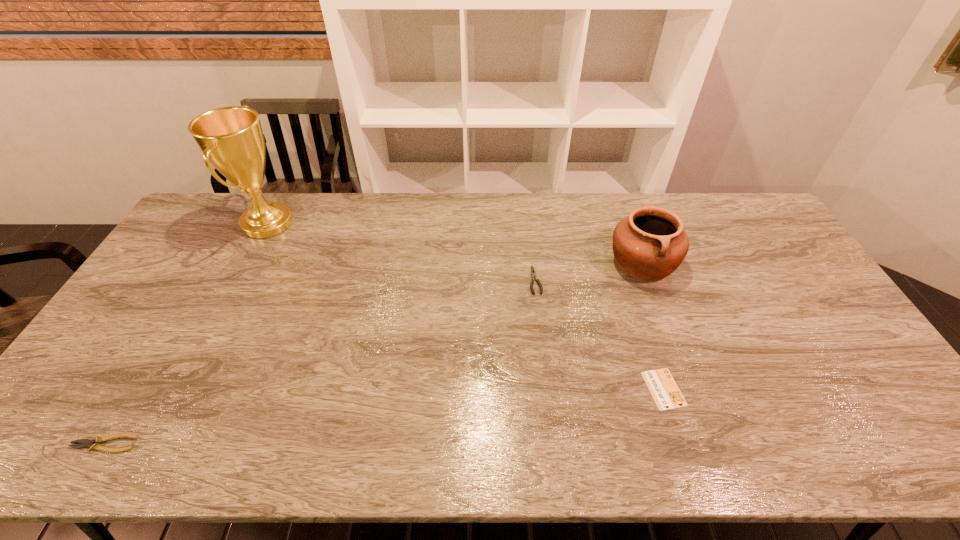
Image resolution: width=960 pixels, height=540 pixels. I want to click on free space between the left pliers and the pottery, so click(373, 353).

Locate an element on the screen. This screenshot has width=960, height=540. free space that is in between the tallest object and the pottery is located at coordinates (455, 244).

Select which object appears as the third closest to the nearest object. Please provide its 2D coordinates. Your answer should be formatted as a tuple, i.e. [(x, y)], where the tuple contains the x and y coordinates of a point satisfying the conditions above.

[(664, 390)]

Locate which object ranks fourth in proximity to the right pliers. Please provide its 2D coordinates. Your answer should be formatted as a tuple, i.e. [(x, y)], where the tuple contains the x and y coordinates of a point satisfying the conditions above.

[(94, 444)]

This screenshot has width=960, height=540. In order to click on free spot that satisfies the following two spatial constraints: 1. on the back side of the fourth shortest object; 2. on the left side of the left pliers in this screenshot , I will do `click(213, 263)`.

Image resolution: width=960 pixels, height=540 pixels. Find the location of `vacant space that satisfies the following two spatial constraints: 1. by the handles of the award; 2. on the back side of the second tallest object`. vacant space that satisfies the following two spatial constraints: 1. by the handles of the award; 2. on the back side of the second tallest object is located at coordinates (247, 263).

Image resolution: width=960 pixels, height=540 pixels. I want to click on vacant region that satisfies the following two spatial constraints: 1. by the handles of the award; 2. on the right side of the third object from right to left, so click(238, 280).

Where is `blank area in the image that satisfies the following two spatial constraints: 1. by the handles of the award; 2. on the back side of the farther pliers`? This screenshot has height=540, width=960. blank area in the image that satisfies the following two spatial constraints: 1. by the handles of the award; 2. on the back side of the farther pliers is located at coordinates (238, 280).

This screenshot has width=960, height=540. Find the location of `free point that satisfies the following two spatial constraints: 1. by the handles of the tallest object; 2. on the back side of the pottery`. free point that satisfies the following two spatial constraints: 1. by the handles of the tallest object; 2. on the back side of the pottery is located at coordinates (247, 263).

Identify the location of vacant area that satisfies the following two spatial constraints: 1. on the back side of the farther pliers; 2. by the handles of the tallest object. The width and height of the screenshot is (960, 540). (528, 224).